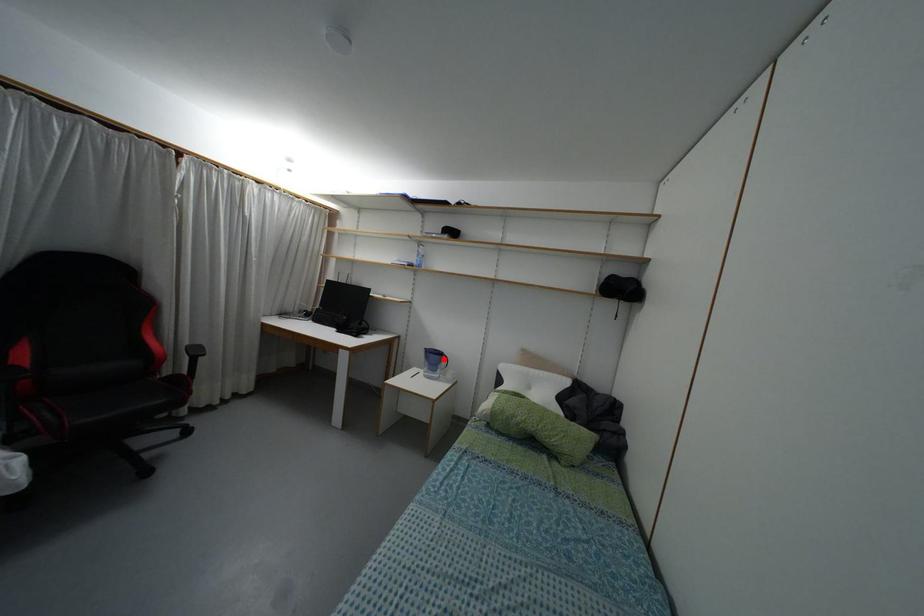
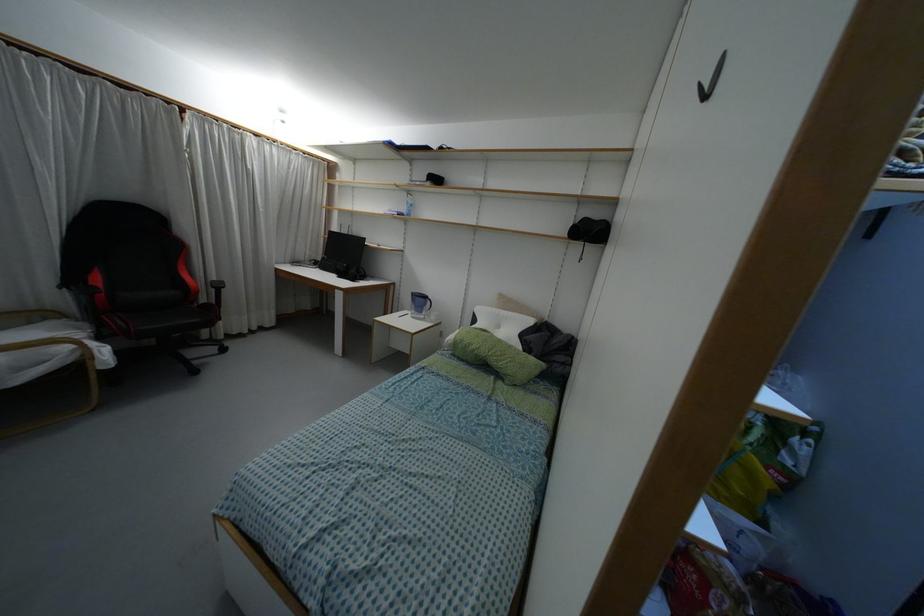
The point at the highlighted location is marked in the first image. Where is the corresponding point in the second image?

(428, 302)